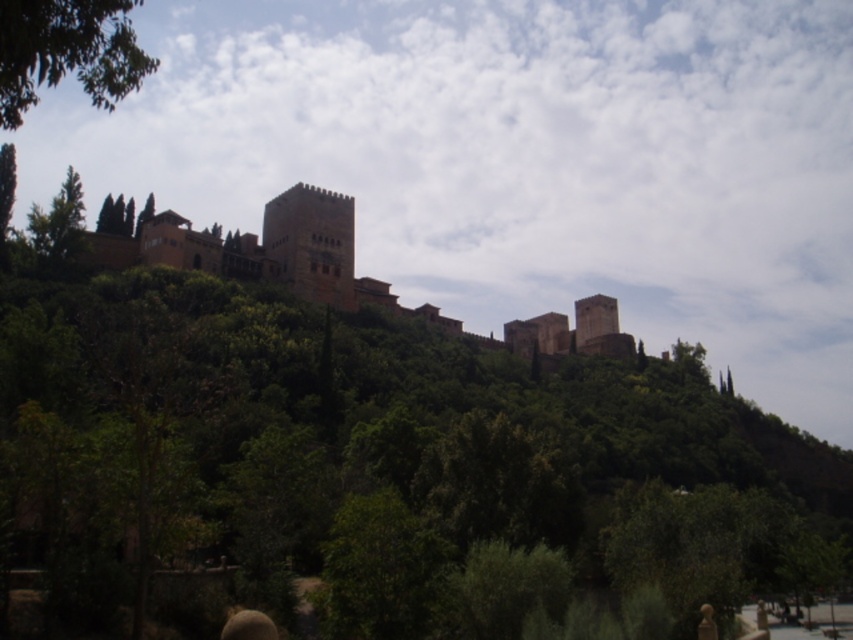
You are standing in front of the brown stone castle at center and want to walk to the green leafy tree at left. Which direction should you face to walk towards it?

You should face towards the left direction to walk towards the green leafy tree at left from the brown stone castle at center.

You are an architect examining the fortress and notice the brown textured head at lower center and the green leafy tree at left. Which object is smaller in size?

The brown textured head at lower center is smaller in size compared to the green leafy tree at left.

You are standing at the base of the fortress and want to reach the entrance located at point (4, 150). There is an obstacle at point (235, 632) blocking your path. Can you navigate around it to reach the entrance?

Point (235, 632) is in front of point (4, 150), so the obstacle is blocking the direct path. You will need to navigate around it to reach the entrance.